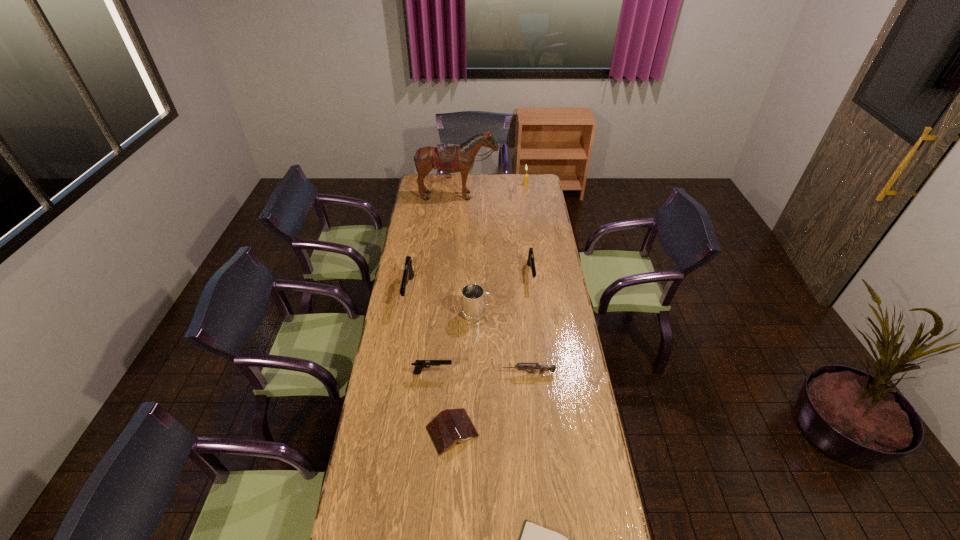
Where is `brown saddle`? Image resolution: width=960 pixels, height=540 pixels. brown saddle is located at coordinates (451, 159).

Find the location of a particular element. Image resolution: width=960 pixels, height=540 pixels. the eighth nearest object is located at coordinates (451, 159).

This screenshot has height=540, width=960. I want to click on candle, so click(x=525, y=183).

Locate an element on the screen. The width and height of the screenshot is (960, 540). the farthest object is located at coordinates (525, 183).

Where is `mug`? mug is located at coordinates (473, 305).

Locate an element on the screen. This screenshot has height=540, width=960. the leftmost black gun is located at coordinates 408,273.

Where is `the leftmost gun`? Image resolution: width=960 pixels, height=540 pixels. the leftmost gun is located at coordinates (408, 273).

Identify the location of the second tallest gun. (531, 263).

Find the location of a particular element. the fifth shortest object is located at coordinates (531, 263).

This screenshot has width=960, height=540. In order to click on the second black gun from left to right in this screenshot , I will do `click(419, 364)`.